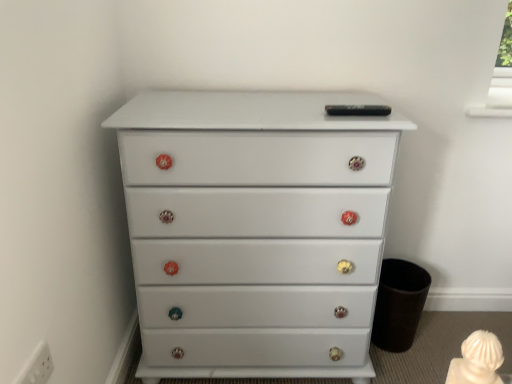
Question: From a real-world perspective, is white glossy chest of drawers at center positioned above or below white plastic electric outlet at lower left?

Choices:
 (A) below
 (B) above

Answer: (A)

Question: Is white glossy chest of drawers at center inside or outside of white plastic electric outlet at lower left?

Choices:
 (A) inside
 (B) outside

Answer: (B)

Question: From their relative heights in the image, would you say white glossy chest of drawers at center is taller or shorter than white plastic electric outlet at lower left?

Choices:
 (A) short
 (B) tall

Answer: (B)

Question: Considering the positions of white plastic electric outlet at lower left and white glossy chest of drawers at center in the image, is white plastic electric outlet at lower left taller or shorter than white glossy chest of drawers at center?

Choices:
 (A) tall
 (B) short

Answer: (B)

Question: From the image's perspective, is white plastic electric outlet at lower left located above or below white glossy chest of drawers at center?

Choices:
 (A) above
 (B) below

Answer: (B)

Question: Relative to white glossy chest of drawers at center, is white plastic electric outlet at lower left in front or behind?

Choices:
 (A) front
 (B) behind

Answer: (A)

Question: From a real-world perspective, is white plastic electric outlet at lower left above or below white glossy chest of drawers at center?

Choices:
 (A) below
 (B) above

Answer: (B)